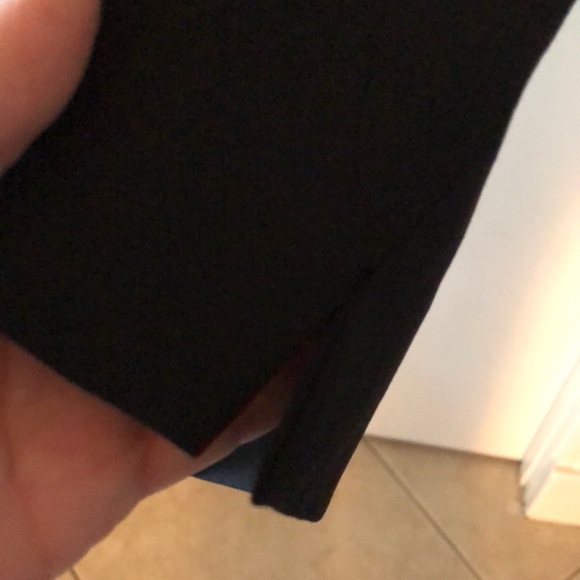
Find the location of a particular element. floor is located at coordinates (452, 493), (385, 532).